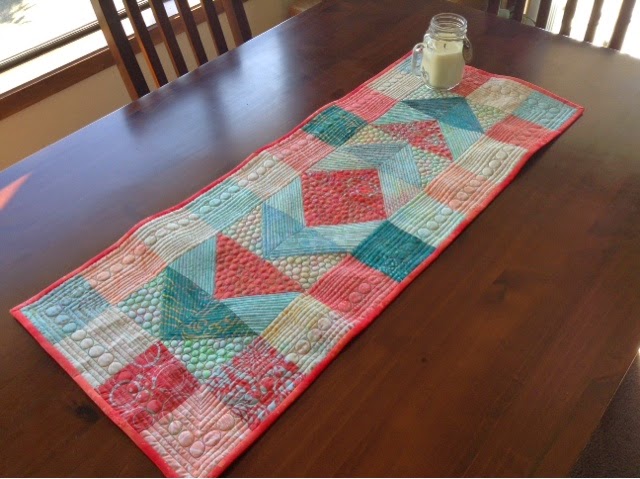
Locate an element on the screen. wood piece is located at coordinates (537, 445).